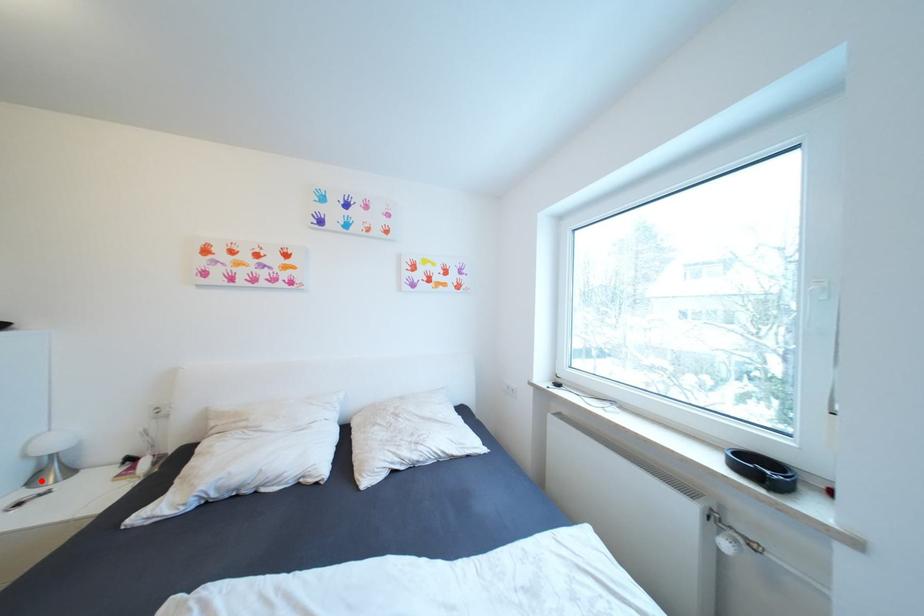
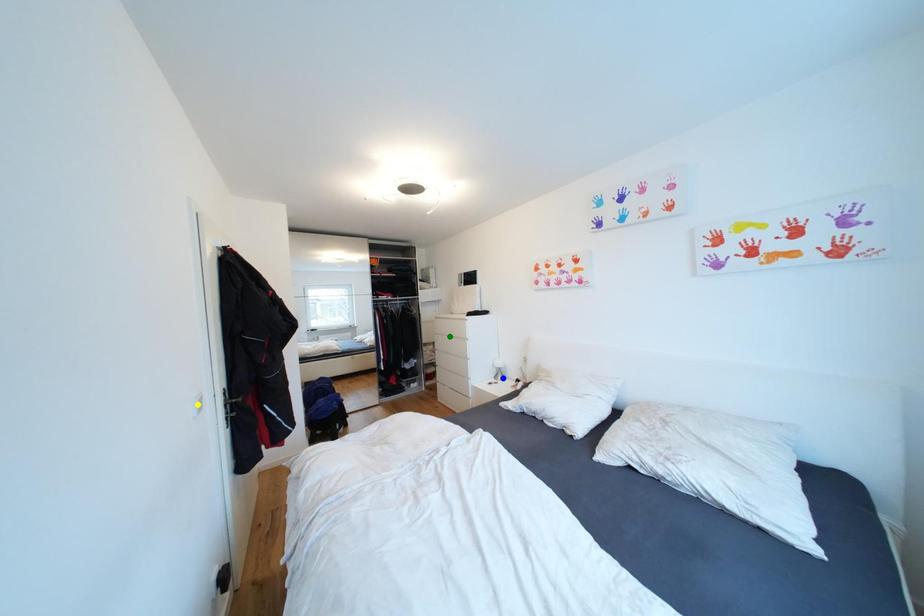
Question: I am providing you with two images of the same scene from different viewpoints. A red point is marked on the first image. You are given multiple points on the second image. Which point in image 2 represents the same 3d spot as the red point in image 1?

Choices:
 (A) blue point
 (B) yellow point
 (C) green point

Answer: (A)